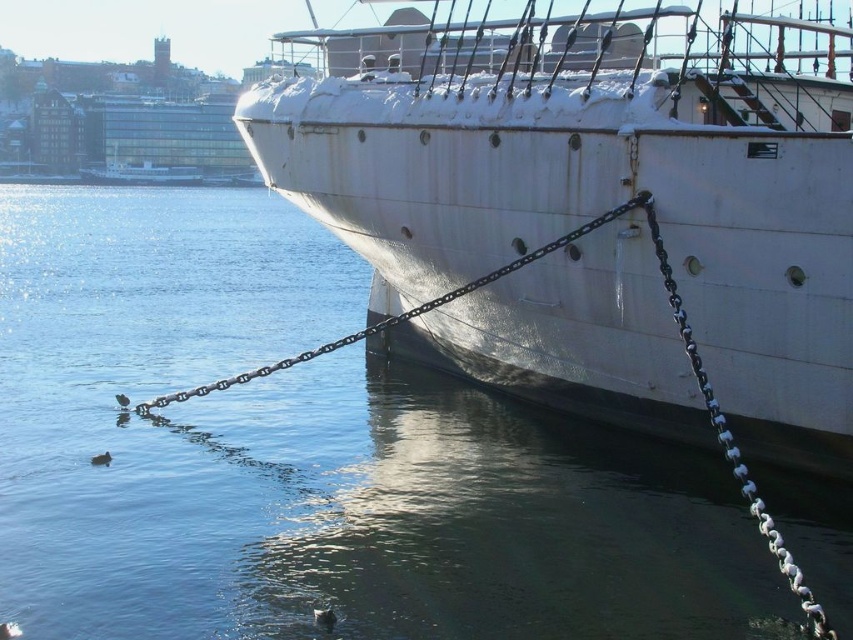
Question: Is clear water at lower left further to the viewer compared to metallic chain at lower center?

Choices:
 (A) yes
 (B) no

Answer: (B)

Question: Which point is closer to the camera?

Choices:
 (A) clear water at lower left
 (B) metallic chain at lower center

Answer: (A)

Question: Which of the following is the farthest from the observer?

Choices:
 (A) silver metallic chain at right
 (B) clear water at lower left

Answer: (B)

Question: Does clear water at lower left have a larger size compared to metallic chain at lower center?

Choices:
 (A) yes
 (B) no

Answer: (A)

Question: Can you confirm if white matte ship at center is positioned below metallic chain at lower center?

Choices:
 (A) no
 (B) yes

Answer: (A)

Question: Which point appears closest to the camera in this image?

Choices:
 (A) (784, 531)
 (B) (782, 541)

Answer: (B)